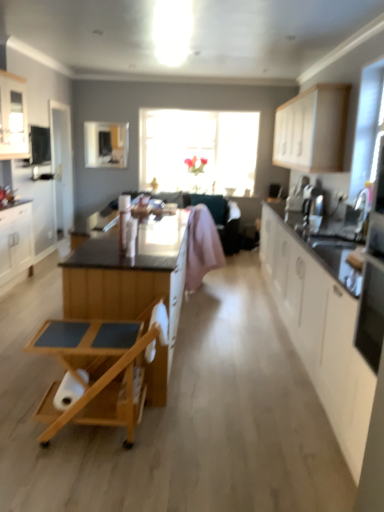
Question: Does white glossy cabinet at upper left, the 4th cabinetry in the right-to-left sequence, have a smaller size compared to white matte cabinet at upper right, placed as the first cabinetry when sorted from right to left?

Choices:
 (A) no
 (B) yes

Answer: (B)

Question: Does white glossy cabinet at upper left, the 4th cabinetry in the right-to-left sequence, have a greater width compared to white matte cabinet at upper right, placed as the first cabinetry when sorted from right to left?

Choices:
 (A) yes
 (B) no

Answer: (B)

Question: Are white glossy cabinet at upper left, the 4th cabinetry in the right-to-left sequence, and white matte cabinet at upper right, placed as the first cabinetry when sorted from right to left, making contact?

Choices:
 (A) no
 (B) yes

Answer: (A)

Question: Is white glossy cabinet at upper left, which is counted as the second cabinetry, starting from the left, not inside white matte cabinet at upper right, placed as the first cabinetry when sorted from right to left?

Choices:
 (A) yes
 (B) no

Answer: (A)

Question: Considering the relative positions of white glossy cabinet at upper left, which is counted as the second cabinetry, starting from the left, and white matte cabinet at upper right, the 5th cabinetry positioned from the left, in the image provided, is white glossy cabinet at upper left, which is counted as the second cabinetry, starting from the left, behind white matte cabinet at upper right, the 5th cabinetry positioned from the left,?

Choices:
 (A) no
 (B) yes

Answer: (A)

Question: Considering the positions of white glossy cabinet at left, marked as the 1th cabinetry in a left-to-right arrangement, and white glossy cabinet at upper left, the 4th cabinetry in the right-to-left sequence, in the image, is white glossy cabinet at left, marked as the 1th cabinetry in a left-to-right arrangement, bigger or smaller than white glossy cabinet at upper left, the 4th cabinetry in the right-to-left sequence,?

Choices:
 (A) big
 (B) small

Answer: (A)

Question: Is point (18, 233) positioned closer to the camera than point (26, 152)?

Choices:
 (A) farther
 (B) closer

Answer: (B)

Question: From the image's perspective, is white glossy cabinet at left, the 5th cabinetry in the right-to-left sequence, above or below white glossy cabinet at upper left, the 4th cabinetry in the right-to-left sequence?

Choices:
 (A) above
 (B) below

Answer: (B)

Question: In the image, is white glossy cabinet at left, marked as the 1th cabinetry in a left-to-right arrangement, positioned in front of or behind white glossy cabinet at upper left, the 4th cabinetry in the right-to-left sequence?

Choices:
 (A) behind
 (B) front

Answer: (A)

Question: Is point (92, 345) closer or farther from the camera than point (173, 269)?

Choices:
 (A) closer
 (B) farther

Answer: (B)

Question: From a real-world perspective, is wooden rolling cart at center above or below wooden cart at center, arranged as the third cabinetry when viewed from the right?

Choices:
 (A) above
 (B) below

Answer: (B)

Question: In the image, is wooden rolling cart at center on the left side or the right side of wooden cart at center, the third cabinetry when ordered from left to right?

Choices:
 (A) left
 (B) right

Answer: (B)

Question: From their relative heights in the image, would you say wooden rolling cart at center is taller or shorter than wooden cart at center, the third cabinetry when ordered from left to right?

Choices:
 (A) tall
 (B) short

Answer: (B)

Question: From a real-world perspective, is white glossy cabinet at upper left, the 4th cabinetry in the right-to-left sequence, above or below pink fabric armchair at center?

Choices:
 (A) above
 (B) below

Answer: (A)

Question: Is white glossy cabinet at upper left, which is counted as the second cabinetry, starting from the left, taller or shorter than pink fabric armchair at center?

Choices:
 (A) short
 (B) tall

Answer: (A)